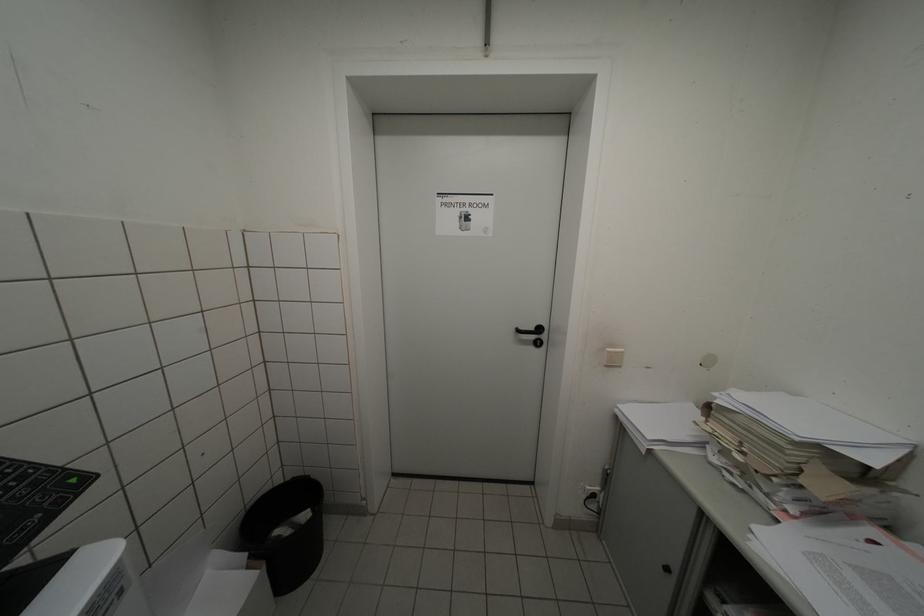
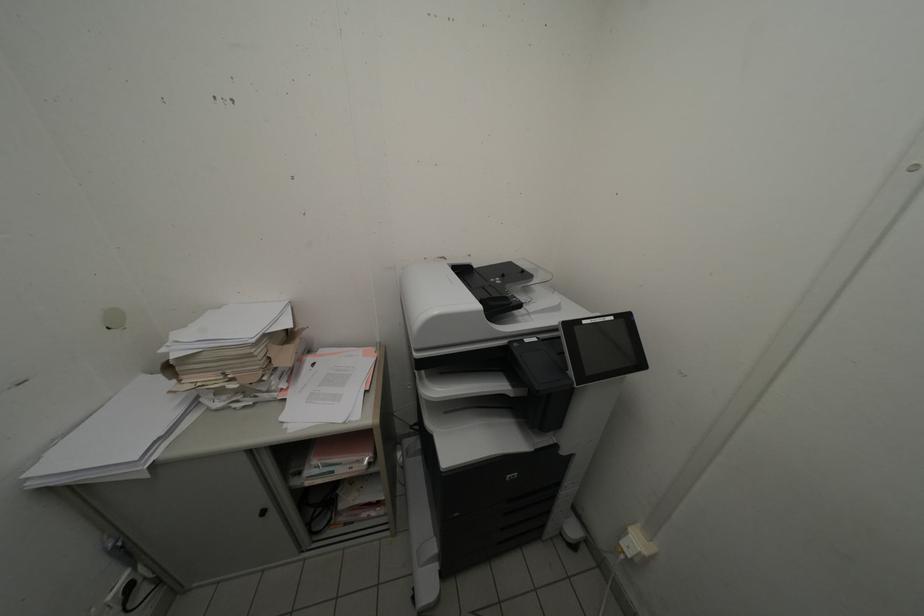
How did the camera likely rotate?

The camera rotated toward right-down.